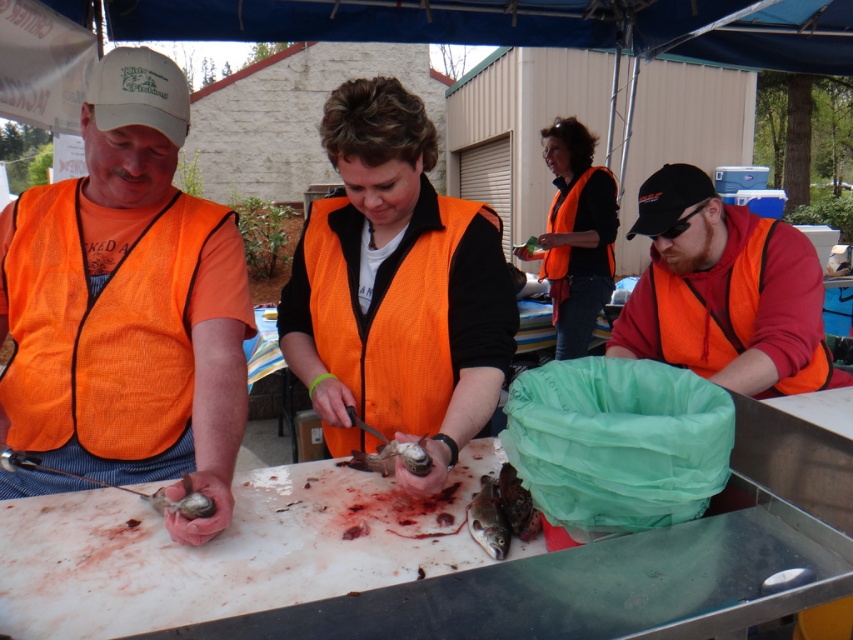
Question: Where is orange mesh vest at center located in relation to orange fabric vest at right in the image?

Choices:
 (A) below
 (B) above

Answer: (A)

Question: Considering the real-world distances, which object is closest to the orange fabric vest at right?

Choices:
 (A) orange fabric life jacket at upper center
 (B) dark brown fish at center

Answer: (B)

Question: Which object is closer to the camera taking this photo?

Choices:
 (A) orange fabric vest at right
 (B) dark brown fish at center

Answer: (B)

Question: Can you confirm if orange mesh vest at center is wider than orange fabric vest at right?

Choices:
 (A) yes
 (B) no

Answer: (B)

Question: Is orange mesh vest at center wider than shiny silver fish at center?

Choices:
 (A) no
 (B) yes

Answer: (B)

Question: Among these points, which one is nearest to the camera?

Choices:
 (A) [339, 464]
 (B) [534, 524]

Answer: (B)